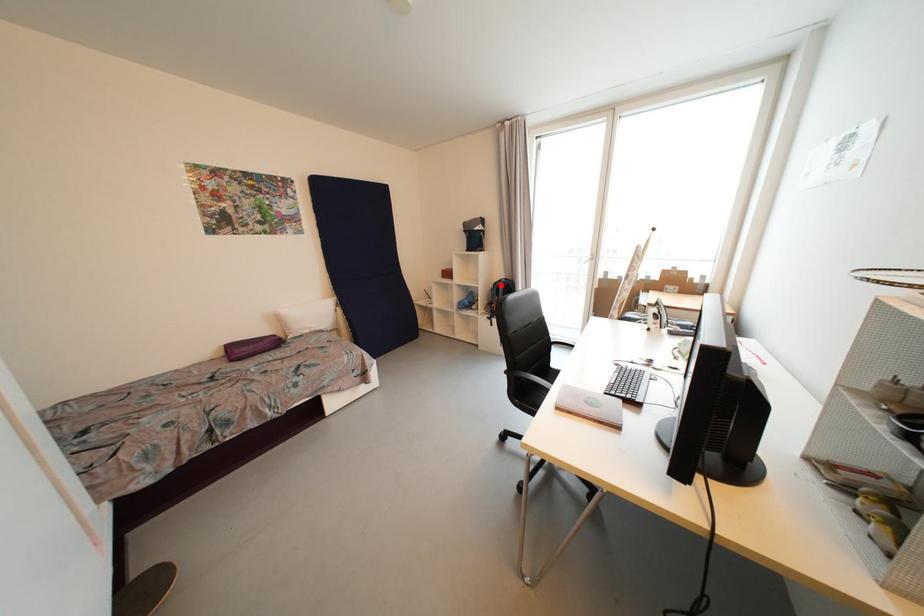
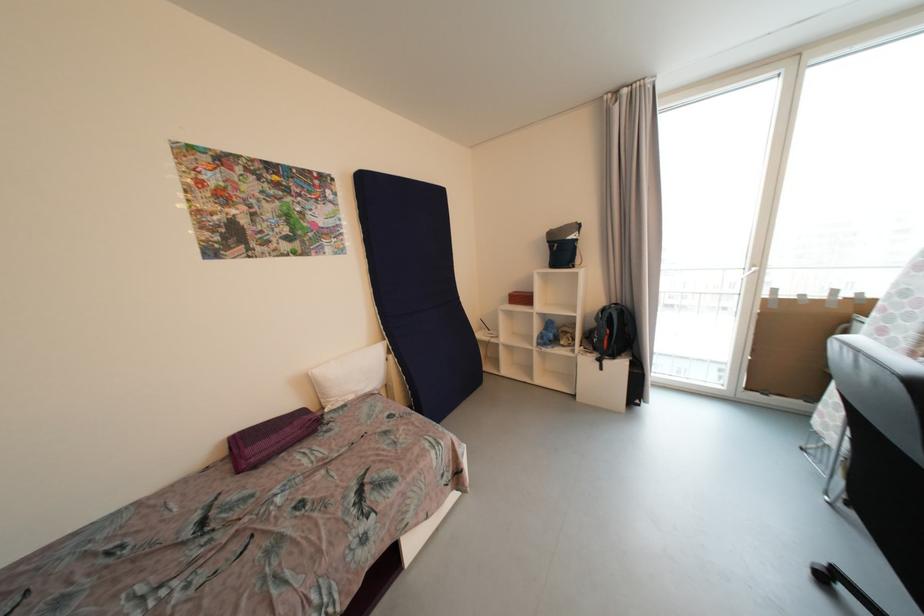
The point at the highlighted location is marked in the first image. Where is the corresponding point in the second image?

(608, 312)